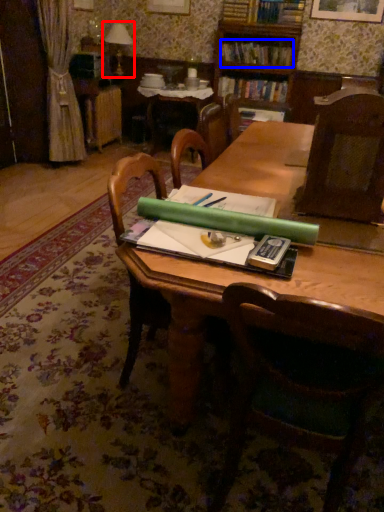
Question: Which point is further to the camera, table lamp (highlighted by a red box) or book (highlighted by a blue box)?

Choices:
 (A) table lamp
 (B) book

Answer: (A)